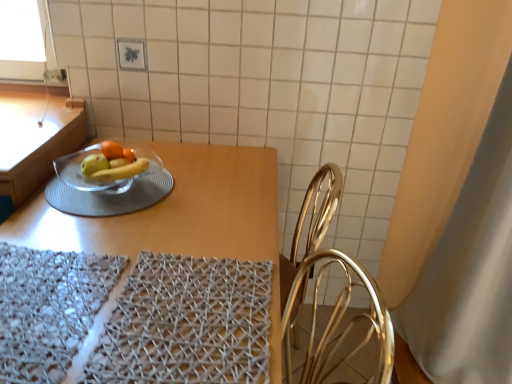
At what (x,y) coordinates should I click in order to perform the action: click on vacant space behind woven fabric place mat at lower center, acting as the second place mat starting from the left. Please return your answer as a coordinate pair (x, y). Image resolution: width=512 pixels, height=384 pixels. Looking at the image, I should click on (188, 228).